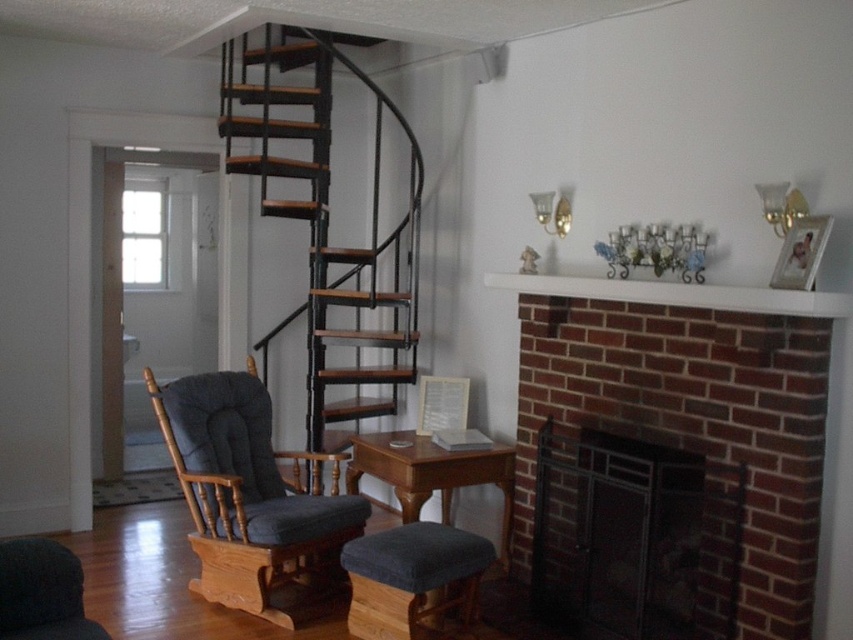
You are standing in the living room and want to place a decorative item on the closest object to you between the brick fireplace at center and the dark gray fabric stool at lower center. Which object should you choose?

The brick fireplace at center is closer to the viewer than the dark gray fabric stool at lower center, so you should place the decorative item on the brick fireplace at center.